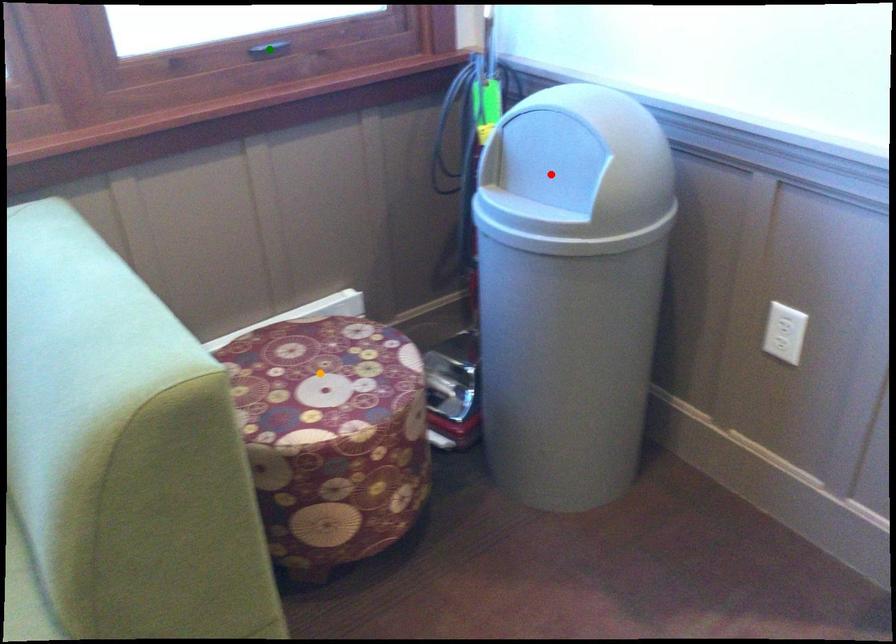
From the picture: Order these from farthest to nearest:
A) red point
B) green point
C) orange point

1. green point
2. orange point
3. red point